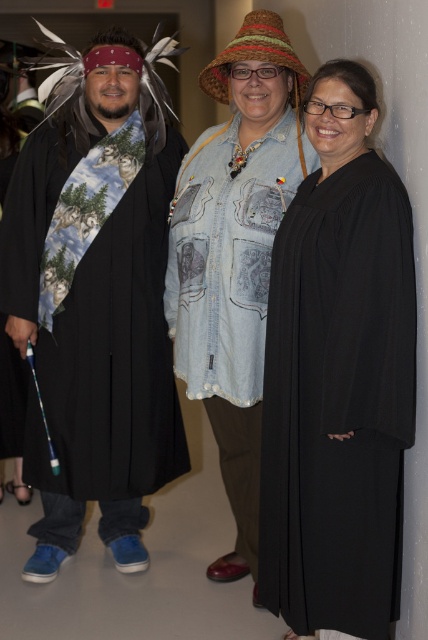
Question: Which point appears farthest from the camera in this image?

Choices:
 (A) (136, 532)
 (B) (306, 164)
 (C) (282, 252)

Answer: (A)

Question: Among these objects, which one is farthest from the camera?

Choices:
 (A) black matte robe at center
 (B) faded denim jacket at center
 (C) matte black robe at left

Answer: (C)

Question: Which of the following is the farthest from the observer?

Choices:
 (A) (347, 520)
 (B) (240, 202)
 (C) (79, 88)

Answer: (C)

Question: Is matte black robe at left positioned before black matte robe at center?

Choices:
 (A) yes
 (B) no

Answer: (B)

Question: Does black matte robe at center come in front of faded denim jacket at center?

Choices:
 (A) no
 (B) yes

Answer: (B)

Question: From the image, what is the correct spatial relationship of matte black robe at left in relation to black matte robe at center?

Choices:
 (A) left
 (B) right

Answer: (A)